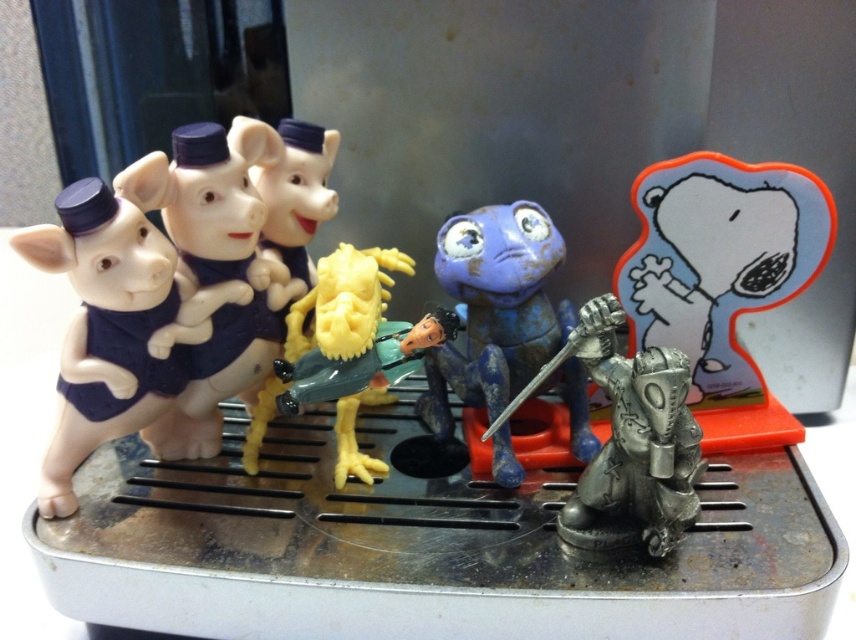
You are organizing a display and need to place the matte plastic pigs at left and the antique silver sword at center on a shelf. The shelf has limited space, and you want to ensure that the larger item is placed first to maximize stability. Which item should you place first?

The matte plastic pigs at left should be placed first because it is larger than the antique silver sword at center, ensuring stability by placing the bigger item first.

You are examining the arrangement of two points on the tray. Which point is closer to you, point (120, 330) or point (609, 301)?

Point (120, 330) is closer to you because it is further to the viewer than point (609, 301).

You are an interior designer arranging miniature figurines on a metal tray. You need to ensure that the matte black piglets at left and the antique silver sword at center are visible from above. Which object will have a larger silhouette when viewed from directly above?

The matte black piglets at left has a greater height compared to the antique silver sword at center, so when viewed from directly above, the matte black piglets at left will have a larger silhouette due to their increased height.